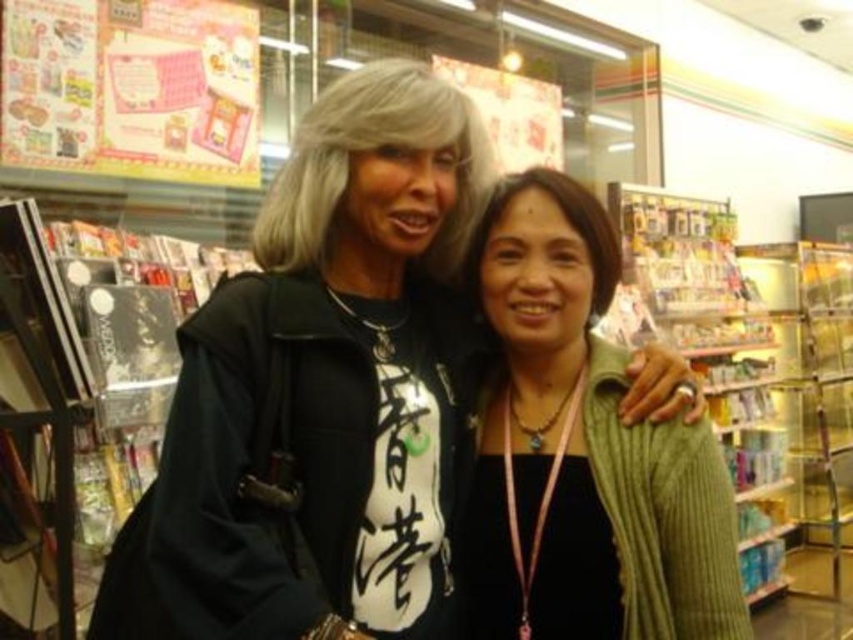
Is matte black jacket at center positioned in front of green knitted sweater at center?

Yes.

Is point (339, 184) in front of point (570, 308)?

That is True.

Where is `matte black jacket at center`? The height and width of the screenshot is (640, 853). matte black jacket at center is located at coordinates (326, 388).